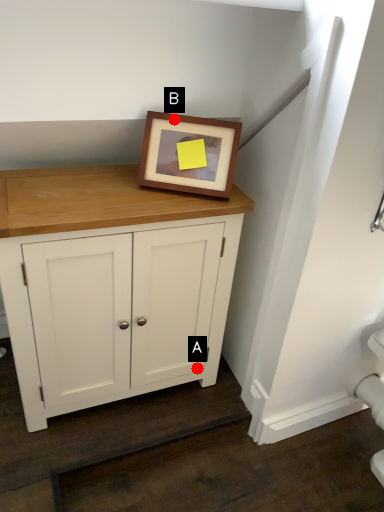
Question: Two points are circled on the image, labeled by A and B beside each circle. Which point is further to the camera?

Choices:
 (A) A is further
 (B) B is further

Answer: (A)